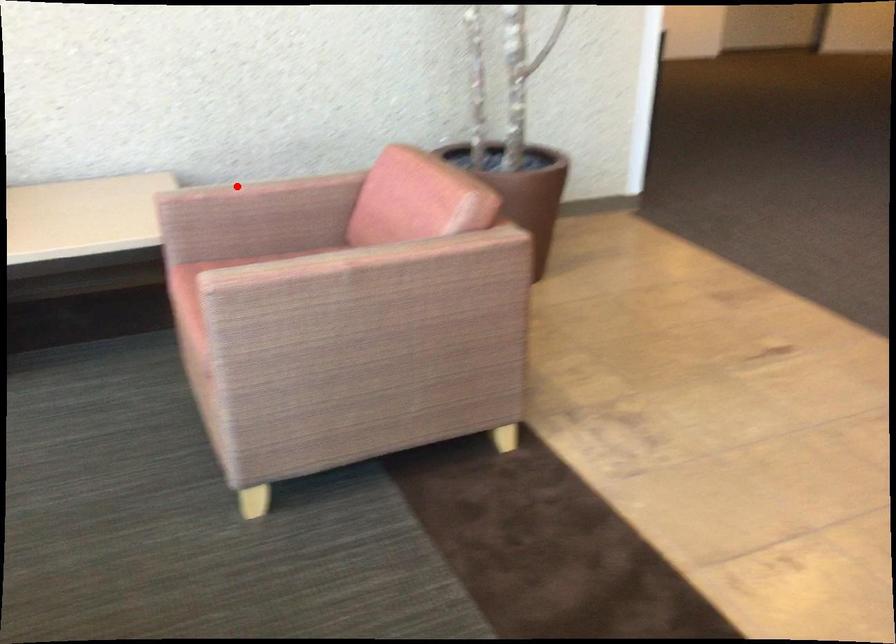
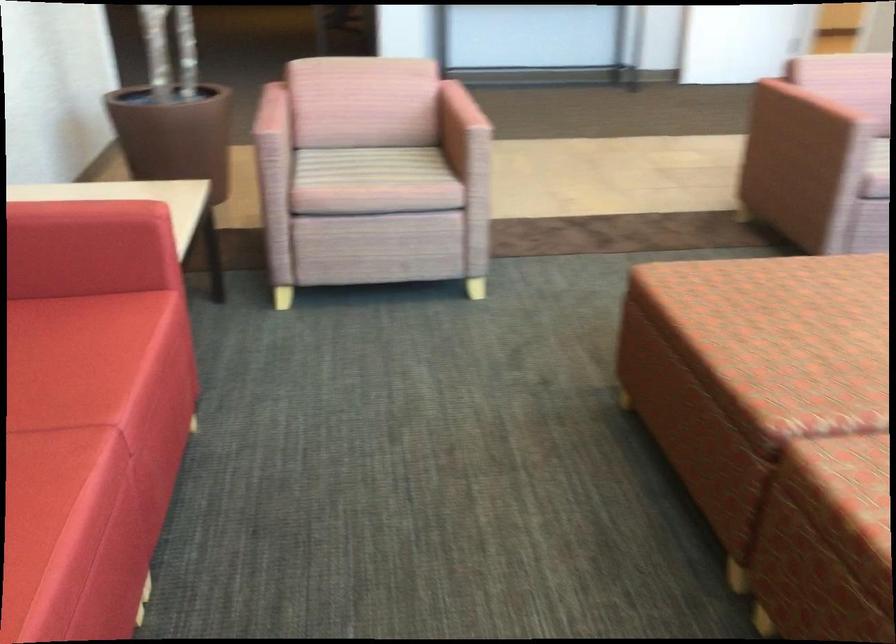
Find the pixel in the second image that matches the highlighted location in the first image.

(271, 113)